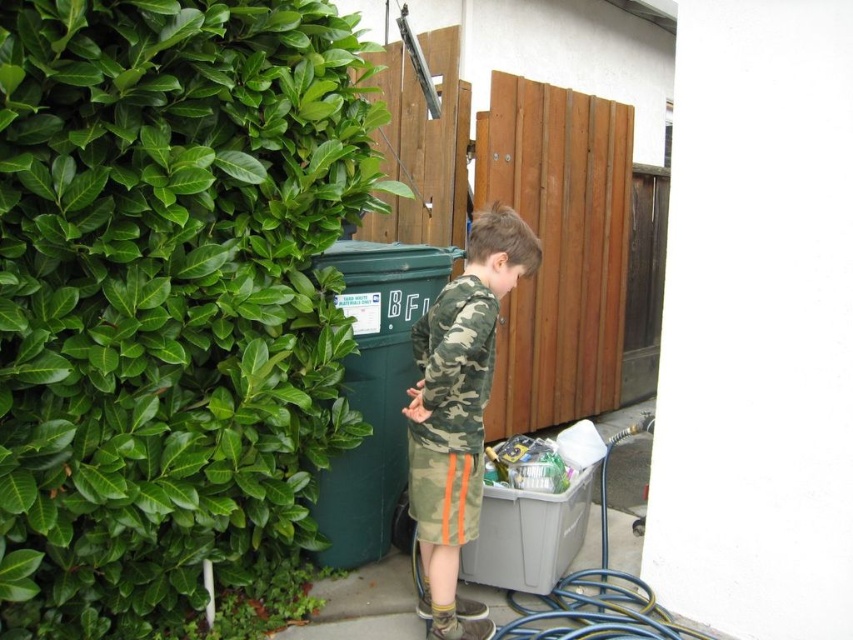
You are standing at the center of the image and want to move towards the green leafy hedge at left. Which direction should you face to walk directly towards it?

The green leafy hedge at left is located at point (167, 294), so you should face towards the left direction to walk directly towards it.

You are a photographer setting up a shot of the boy and the recycling bin. You need to ensure the camo fabric shirt at center and the blue rubber garden hose at lower right are both in focus. Based on their positions, which object is closer to the camera?

The camo fabric shirt at center is above the blue rubber garden hose at lower right, so the camo fabric shirt at center is closer to the camera.